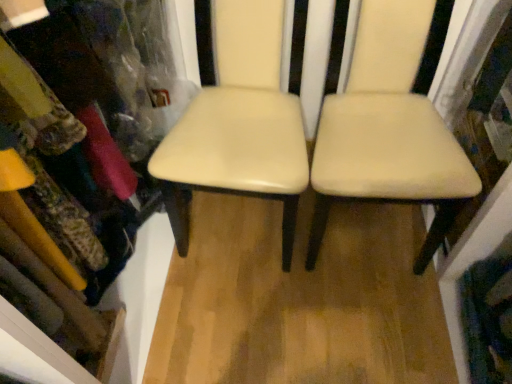
Question: Relative to beige leather chair at center, positioned as the first chair in right-to-left order, is matte plastic bookshelf at upper left in front or behind?

Choices:
 (A) front
 (B) behind

Answer: (A)

Question: In terms of width, does matte plastic bookshelf at upper left look wider or thinner when compared to beige leather chair at center, which is counted as the second chair, starting from the left?

Choices:
 (A) thin
 (B) wide

Answer: (A)

Question: Which object is the closest to the cream leather chair at center, acting as the 1th chair starting from the left?

Choices:
 (A) beige leather chair at center, which is counted as the second chair, starting from the left
 (B) matte plastic bookshelf at upper left

Answer: (A)

Question: Estimate the real-world distances between objects in this image. Which object is farther from the matte plastic bookshelf at upper left?

Choices:
 (A) beige leather chair at center, positioned as the first chair in right-to-left order
 (B) cream leather chair at center, which is the 2th chair in right-to-left order

Answer: (A)